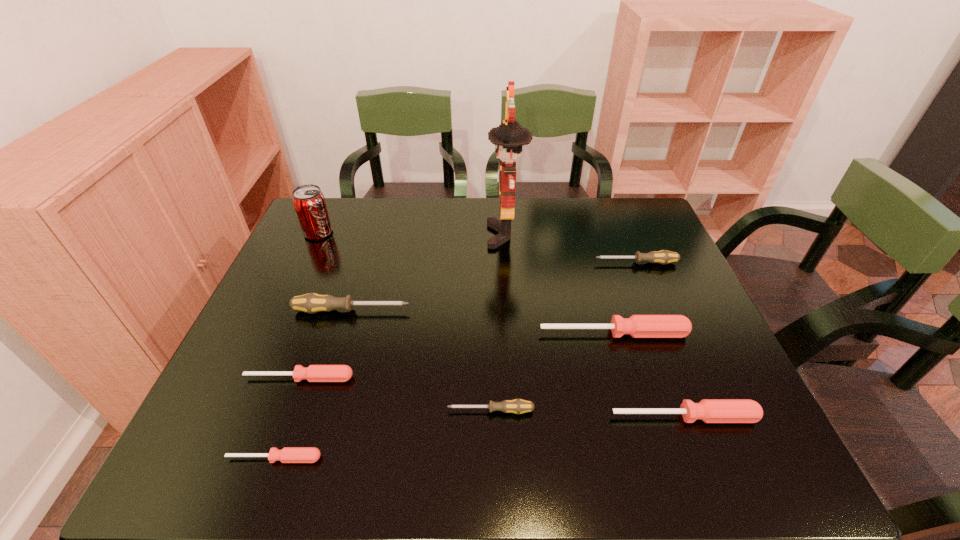
At what (x,y) coordinates should I click in order to perform the action: click on the fourth farthest screwdriver. Please return your answer as a coordinate pair (x, y). The width and height of the screenshot is (960, 540). Looking at the image, I should click on (314, 373).

The width and height of the screenshot is (960, 540). Find the location of `the second farthest red screwdriver`. the second farthest red screwdriver is located at coordinates (314, 373).

The height and width of the screenshot is (540, 960). In order to click on the nearest gray screwdriver in this screenshot , I will do `click(517, 406)`.

Identify the location of the second gray screwdriver from right to left. This screenshot has height=540, width=960. (517, 406).

Locate an element on the screen. This screenshot has height=540, width=960. the smallest red screwdriver is located at coordinates (288, 454).

What are the coordinates of `the shortest screwdriver` in the screenshot? It's located at (x=288, y=454).

I want to click on free location located 0.360m on the front-facing side of the nutcracker, so click(371, 235).

At what (x,y) coordinates should I click in order to perform the action: click on vacant space situated 0.330m on the front-facing side of the nutcracker. Please return your answer as a coordinate pair (x, y). Looking at the image, I should click on (381, 235).

Where is `free location located on the front-facing side of the nutcracker`? free location located on the front-facing side of the nutcracker is located at coordinates (381, 235).

I want to click on free space located 0.360m on the right of the pop soda, so click(x=447, y=233).